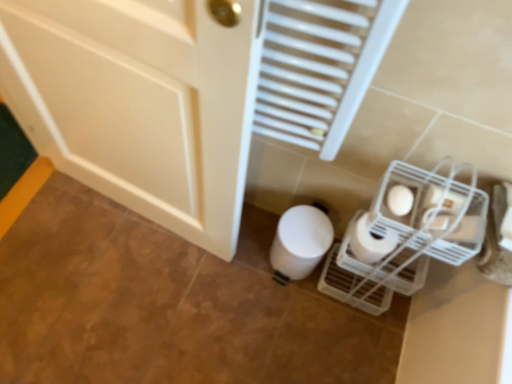
Question: Is white matte toilet paper at lower right, which appears as the second toilet paper when viewed from the back, facing towards white matte toilet paper at lower right, the third toilet paper positioned from the back?

Choices:
 (A) no
 (B) yes

Answer: (A)

Question: From the image's perspective, would you say white matte toilet paper at lower right, which appears as the second toilet paper when viewed from the back, is positioned over white matte toilet paper at lower right, the third toilet paper positioned from the back?

Choices:
 (A) no
 (B) yes

Answer: (A)

Question: Is white matte toilet paper at lower right, which is the 2th toilet paper in front-to-back order, positioned before white matte toilet paper at lower right, the first toilet paper in the front-to-back sequence?

Choices:
 (A) no
 (B) yes

Answer: (A)

Question: Is white matte toilet paper at lower right, which is the 2th toilet paper in front-to-back order, looking in the opposite direction of white matte toilet paper at lower right, the third toilet paper positioned from the back?

Choices:
 (A) yes
 (B) no

Answer: (B)

Question: Can you confirm if white matte toilet paper at lower right, which appears as the second toilet paper when viewed from the back, is bigger than white matte toilet paper at lower right, the third toilet paper positioned from the back?

Choices:
 (A) no
 (B) yes

Answer: (B)

Question: Is white matte toilet paper at lower right, which is the 2th toilet paper in front-to-back order, thinner than white matte toilet paper at lower right, the first toilet paper in the front-to-back sequence?

Choices:
 (A) yes
 (B) no

Answer: (B)

Question: Does white matte toilet paper at lower right, which is the 2th toilet paper in front-to-back order, have a smaller size compared to white plastic radiator at upper center?

Choices:
 (A) no
 (B) yes

Answer: (B)

Question: Is white matte toilet paper at lower right, which is the 2th toilet paper in front-to-back order, aimed at white plastic radiator at upper center?

Choices:
 (A) yes
 (B) no

Answer: (B)

Question: Is white matte toilet paper at lower right, which is the 2th toilet paper in front-to-back order, wider than white plastic radiator at upper center?

Choices:
 (A) yes
 (B) no

Answer: (A)

Question: From the image's perspective, is white matte toilet paper at lower right, which is the 2th toilet paper in front-to-back order, located beneath white plastic radiator at upper center?

Choices:
 (A) yes
 (B) no

Answer: (A)

Question: Is white matte toilet paper at lower right, which appears as the second toilet paper when viewed from the back, next to white plastic radiator at upper center and touching it?

Choices:
 (A) no
 (B) yes

Answer: (A)

Question: Is white matte toilet paper at lower right, which appears as the second toilet paper when viewed from the back, to the left of white plastic radiator at upper center from the viewer's perspective?

Choices:
 (A) yes
 (B) no

Answer: (B)

Question: Can white matte toilet paper at lower right, the first toilet paper in the front-to-back sequence, be found inside white matte toilet paper at lower center, the third toilet paper from the front?

Choices:
 (A) no
 (B) yes

Answer: (A)